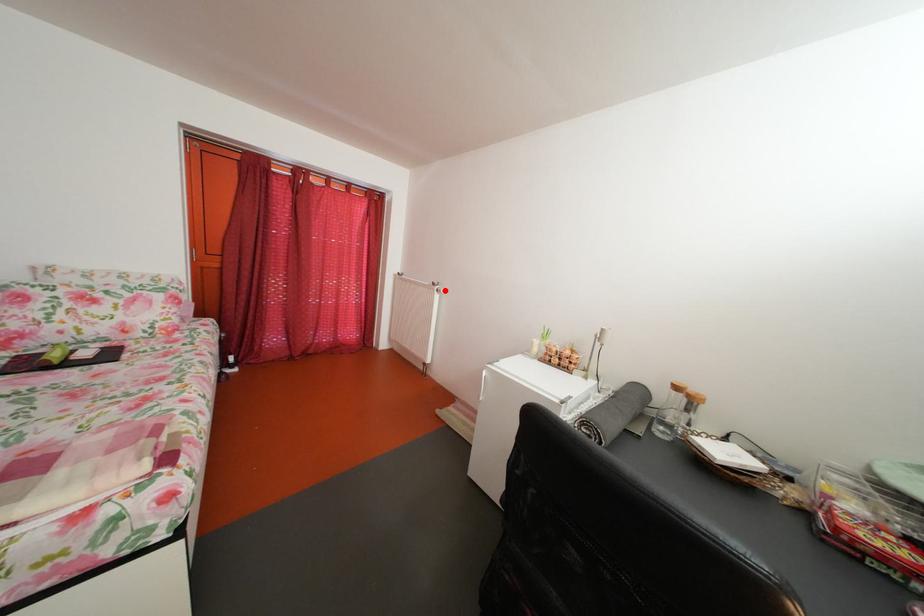
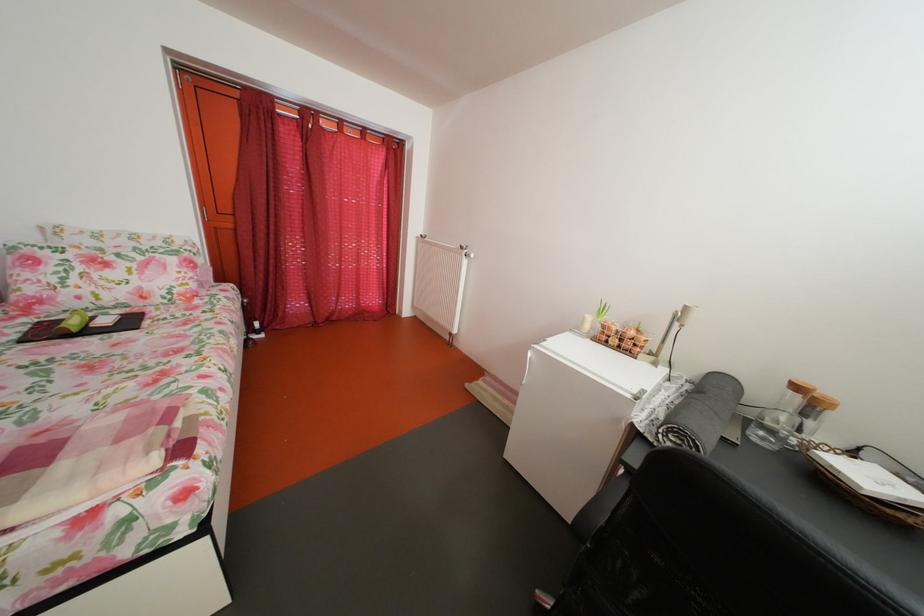
Where in the second image is the point corresponding to the highlighted location from the first image?

(473, 254)